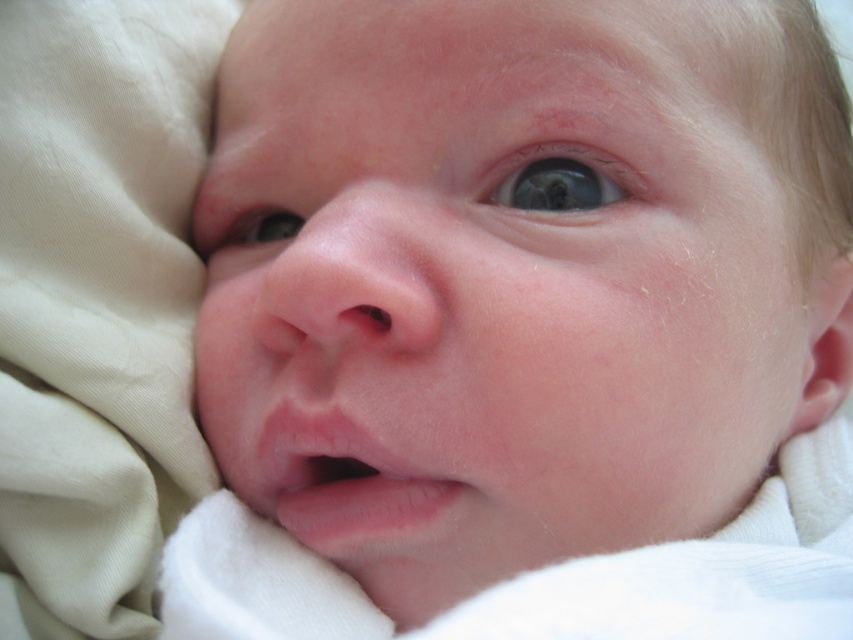
Question: Which of the following is the closest to the observer?

Choices:
 (A) smooth skin face at center
 (B) blue glossy eye at upper center
 (C) blue smooth eye at center

Answer: (A)

Question: In this image, where is smooth skin face at center located relative to blue smooth eye at center?

Choices:
 (A) above
 (B) below

Answer: (B)

Question: Which is farther from the smooth skin face at center?

Choices:
 (A) blue glossy eye at upper center
 (B) blue smooth eye at center

Answer: (B)

Question: Which point is closer to the camera?

Choices:
 (A) (247, 211)
 (B) (532, 179)

Answer: (B)

Question: Is smooth skin face at center further to camera compared to blue glossy eye at upper center?

Choices:
 (A) yes
 (B) no

Answer: (B)

Question: In this image, where is blue glossy eye at upper center located relative to blue smooth eye at center?

Choices:
 (A) right
 (B) left

Answer: (A)